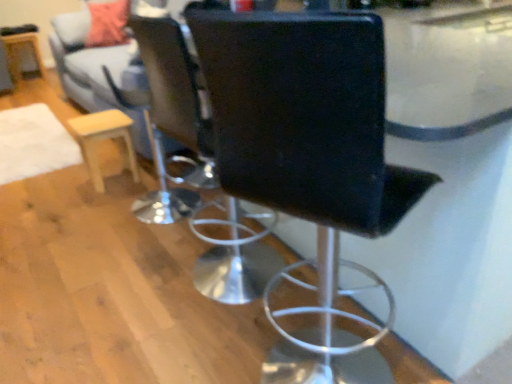
Where is `vacant space in front of black leather chair at center, arranged as the first chair when viewed from the back`? Image resolution: width=512 pixels, height=384 pixels. vacant space in front of black leather chair at center, arranged as the first chair when viewed from the back is located at coordinates (193, 341).